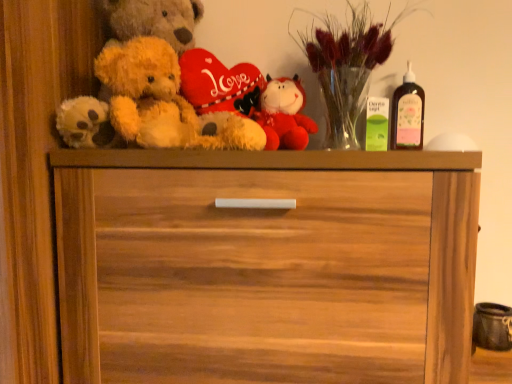
Question: Considering the relative positions of wooden chest of drawers at center and pink glass bottle at upper right in the image provided, is wooden chest of drawers at center to the right of pink glass bottle at upper right from the viewer's perspective?

Choices:
 (A) yes
 (B) no

Answer: (B)

Question: Is wooden chest of drawers at center completely or partially outside of pink glass bottle at upper right?

Choices:
 (A) yes
 (B) no

Answer: (A)

Question: Does wooden chest of drawers at center have a smaller size compared to pink glass bottle at upper right?

Choices:
 (A) no
 (B) yes

Answer: (A)

Question: Is wooden chest of drawers at center aimed at pink glass bottle at upper right?

Choices:
 (A) yes
 (B) no

Answer: (B)

Question: From the image's perspective, is wooden chest of drawers at center below pink glass bottle at upper right?

Choices:
 (A) no
 (B) yes

Answer: (B)

Question: Does point (212, 125) appear closer or farther from the camera than point (263, 96)?

Choices:
 (A) closer
 (B) farther

Answer: (A)

Question: In terms of size, does fluffy beige teddy bear at left appear bigger or smaller than fluffy red plush toy at center?

Choices:
 (A) big
 (B) small

Answer: (A)

Question: Is fluffy beige teddy bear at left in front of or behind fluffy red plush toy at center in the image?

Choices:
 (A) front
 (B) behind

Answer: (A)

Question: Would you say fluffy beige teddy bear at left is to the left or to the right of fluffy red plush toy at center in the picture?

Choices:
 (A) left
 (B) right

Answer: (A)

Question: From a real-world perspective, is pink glass bottle at upper right physically located above or below fluffy red plush toy at center?

Choices:
 (A) above
 (B) below

Answer: (A)

Question: Is pink glass bottle at upper right in front of or behind fluffy red plush toy at center in the image?

Choices:
 (A) behind
 (B) front

Answer: (A)

Question: Is point (391, 127) closer or farther from the camera than point (298, 104)?

Choices:
 (A) farther
 (B) closer

Answer: (B)

Question: From the image's perspective, relative to fluffy red plush toy at center, is pink glass bottle at upper right above or below?

Choices:
 (A) above
 (B) below

Answer: (A)

Question: In the image, is fluffy red plush toy at center on the left side or the right side of fluffy beige teddy bear at left?

Choices:
 (A) right
 (B) left

Answer: (A)

Question: Considering the positions of fluffy red plush toy at center and fluffy beige teddy bear at left in the image, is fluffy red plush toy at center wider or thinner than fluffy beige teddy bear at left?

Choices:
 (A) wide
 (B) thin

Answer: (B)